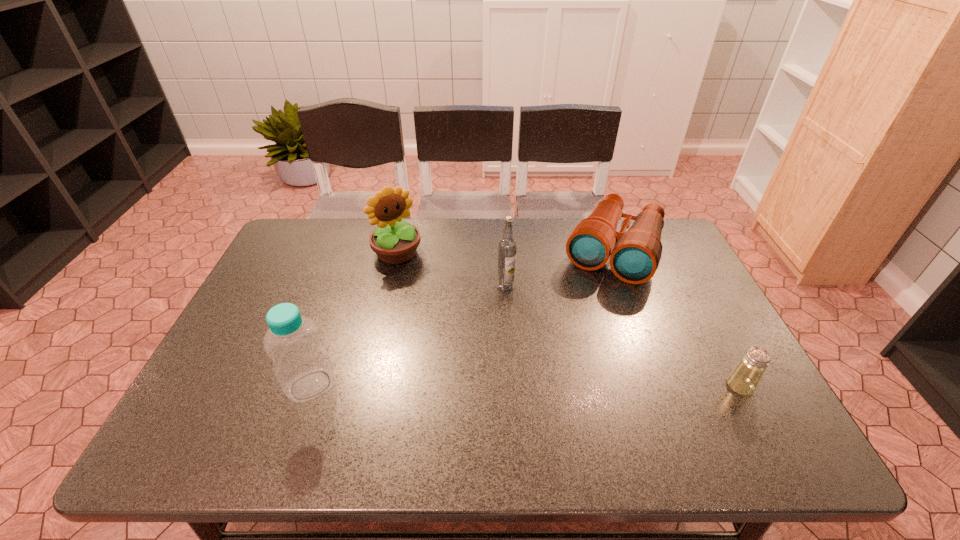
Where is `vacant area that lies between the second shortest object and the saltshaker`? This screenshot has width=960, height=540. vacant area that lies between the second shortest object and the saltshaker is located at coordinates (677, 319).

Where is `vacant point located between the third object from left to right and the binoculars`? Image resolution: width=960 pixels, height=540 pixels. vacant point located between the third object from left to right and the binoculars is located at coordinates (560, 269).

Locate an element on the screen. The width and height of the screenshot is (960, 540). blank region between the bottle and the binoculars is located at coordinates (463, 318).

Identify the location of empty location between the second shortest object and the bottle. This screenshot has height=540, width=960. (463, 318).

Find the location of `free area in between the second shortest object and the shortest object`. free area in between the second shortest object and the shortest object is located at coordinates (677, 319).

The width and height of the screenshot is (960, 540). In order to click on free space between the saltshaker and the sunflower in this screenshot , I will do `click(568, 320)`.

At what (x,y) coordinates should I click in order to perform the action: click on free space between the shortest object and the sunflower. Please return your answer as a coordinate pair (x, y). This screenshot has width=960, height=540. Looking at the image, I should click on (568, 320).

At what (x,y) coordinates should I click in order to perform the action: click on empty space between the saltshaker and the third object from left to right. Please return your answer as a coordinate pair (x, y). The height and width of the screenshot is (540, 960). Looking at the image, I should click on (623, 336).

Image resolution: width=960 pixels, height=540 pixels. In order to click on vacant space that's between the sunflower and the bottle in this screenshot , I will do `click(354, 319)`.

At what (x,y) coordinates should I click in order to perform the action: click on free point between the bottle and the sunflower. Please return your answer as a coordinate pair (x, y). Looking at the image, I should click on (354, 319).